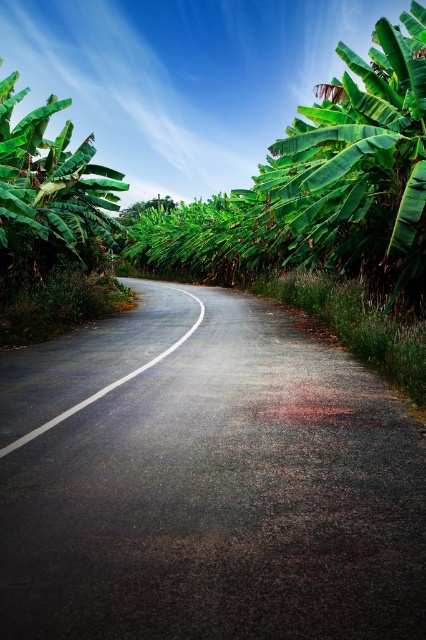
Consider the image. Between white asphalt road at center and green leafy tree at center, which one appears on the left side from the viewer's perspective?

green leafy tree at center is more to the left.

Is white asphalt road at center taller than green leafy tree at center?

No.

In order to click on white asphalt road at center in this screenshot , I will do `click(108, 385)`.

Which of these two, green leafy banana tree at right or white asphalt road at center, stands shorter?

With less height is white asphalt road at center.

Can you confirm if green leafy banana tree at right is positioned to the right of white asphalt road at center?

Correct, you'll find green leafy banana tree at right to the right of white asphalt road at center.

This screenshot has height=640, width=426. Identify the location of green leafy banana tree at right. (357, 168).

I want to click on green leafy banana tree at right, so click(357, 168).

Is green leafy banana tree at right positioned behind green leafy tree at center?

No, it is in front of green leafy tree at center.

Is point (422, 289) more distant than point (169, 209)?

No, it is not.

Is point (322, 141) positioned after point (126, 220)?

That is False.

Locate an element on the screen. The width and height of the screenshot is (426, 640). green leafy banana tree at right is located at coordinates (357, 168).